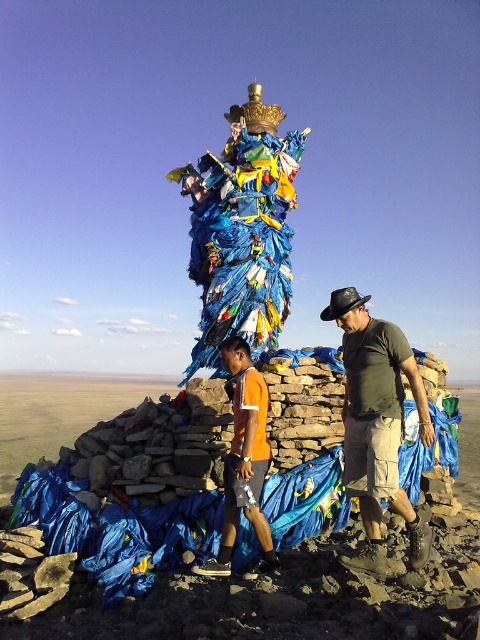
You are standing in the landscape and want to hand a map to the person wearing the matte black shirt at center. Which direction should you approach from relative to the orange fabric shorts at center?

The matte black shirt at center is closer to you than the orange fabric shorts at center, so you should approach from the front side of the orange fabric shorts at center to reach the matte black shirt at center.

You are a photographer setting up a tripod to capture the two people in the scene. You notice the matte black shirt at center and the orange fabric shorts at center. Which clothing item should you focus on to ensure it takes up more space in your photo?

The matte black shirt at center is bigger than the orange fabric shorts at center, so focusing on the matte black shirt at center will ensure it takes up more space in the photo.